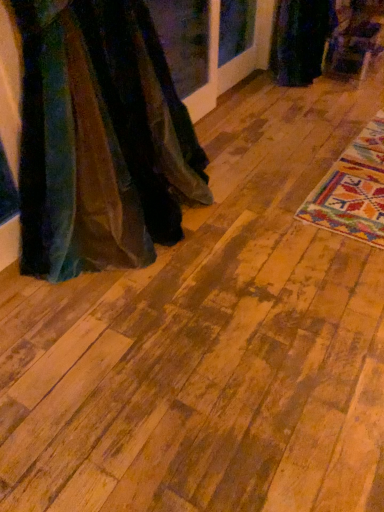
Question: Considering the positions of wooden floor at center and velvet dark green dress at upper right, marked as the second fancy dress in a bottom-to-top arrangement, in the image, is wooden floor at center bigger or smaller than velvet dark green dress at upper right, marked as the second fancy dress in a bottom-to-top arrangement,?

Choices:
 (A) big
 (B) small

Answer: (A)

Question: Considering the relative positions of wooden floor at center and velvet dark green dress at upper right, the 1th fancy dress when ordered from right to left, in the image provided, is wooden floor at center to the left or to the right of velvet dark green dress at upper right, the 1th fancy dress when ordered from right to left,?

Choices:
 (A) right
 (B) left

Answer: (A)

Question: Which of these objects is positioned closest to the wooden floor at center?

Choices:
 (A) velvet dark green dress at upper right, which ranks as the first fancy dress in top-to-bottom order
 (B) velvet fabric dress at left, placed as the 1th fancy dress when sorted from left to right

Answer: (B)

Question: Considering the real-world distances, which object is farthest from the velvet fabric dress at left, the second fancy dress from the top?

Choices:
 (A) velvet dark green dress at upper right, the second fancy dress in the front-to-back sequence
 (B) wooden floor at center

Answer: (A)